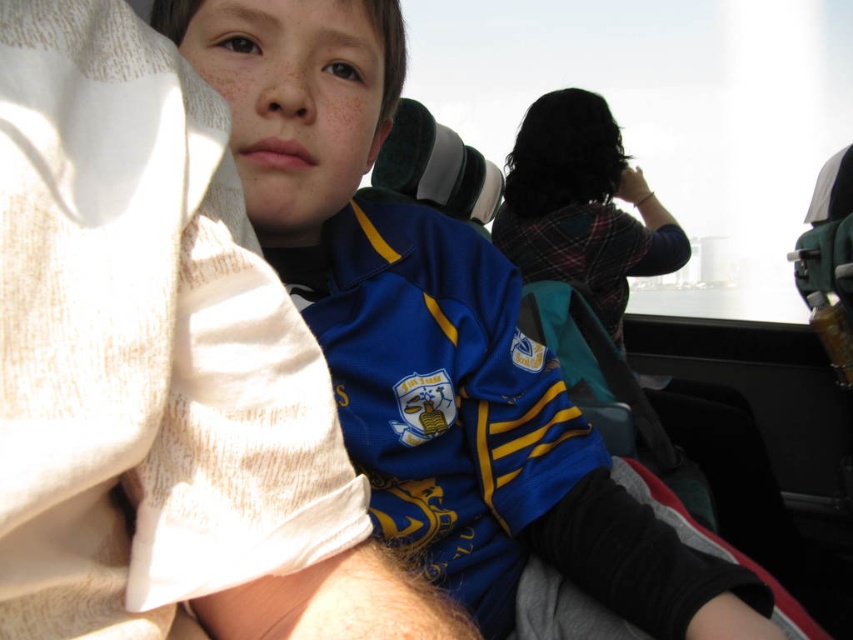
Who is shorter, blue jersey at upper left or blue jersey at center?

blue jersey at upper left

Does blue jersey at upper left appear on the right side of blue jersey at center?

Incorrect, blue jersey at upper left is not on the right side of blue jersey at center.

Is point (67, 509) behind point (337, 364)?

That is False.

The width and height of the screenshot is (853, 640). I want to click on blue jersey at upper left, so click(x=160, y=369).